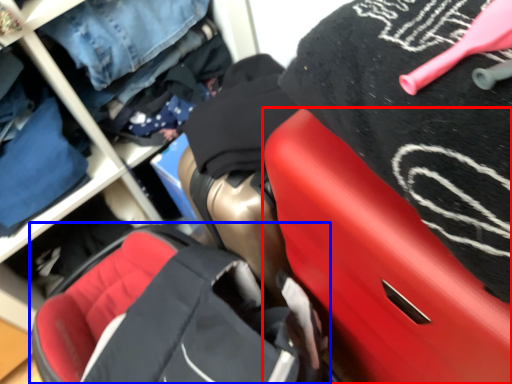
Question: Among these objects, which one is farthest to the camera, luggage (highlighted by a red box) or baby carriage (highlighted by a blue box)?

Choices:
 (A) luggage
 (B) baby carriage

Answer: (B)